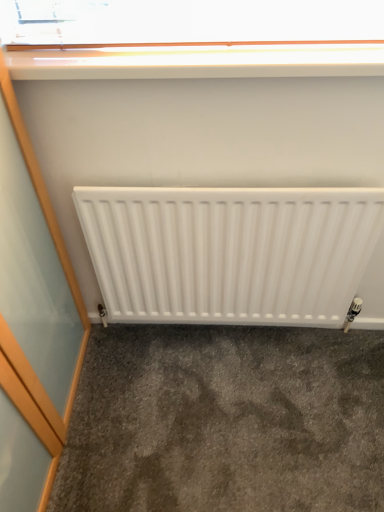
Measure the distance between gray carpet at lower center and camera.

The distance of gray carpet at lower center from camera is 1.34 meters.

This screenshot has height=512, width=384. What do you see at coordinates (197, 62) in the screenshot?
I see `white glossy window sill at upper center` at bounding box center [197, 62].

Identify the location of white matte radiator at center. This screenshot has width=384, height=512. (230, 252).

Where is `radiator in front of the gray carpet at lower center`? radiator in front of the gray carpet at lower center is located at coordinates (230, 252).

Considering the sizes of objects white matte radiator at center and gray carpet at lower center in the image provided, who is wider, white matte radiator at center or gray carpet at lower center?

Wider between the two is gray carpet at lower center.

What's the angular difference between white matte radiator at center and gray carpet at lower center's facing directions?

0.477 degrees.

Is gray carpet at lower center a part of white matte radiator at center?

Definitely not — gray carpet at lower center is not inside white matte radiator at center.

Can you confirm if gray carpet at lower center is bigger than white matte radiator at center?

Incorrect, gray carpet at lower center is not larger than white matte radiator at center.

Which is more to the right, gray carpet at lower center or white matte radiator at center?

Positioned to the right is gray carpet at lower center.

From a real-world perspective, which is physically below, gray carpet at lower center or white matte radiator at center?

In real-world perspective, gray carpet at lower center is lower.

Considering the sizes of objects white glossy window sill at upper center and gray carpet at lower center in the image provided, who is smaller, white glossy window sill at upper center or gray carpet at lower center?

With smaller size is white glossy window sill at upper center.

Does point (110, 56) come closer to viewer compared to point (349, 416)?

Yes, it is in front of point (349, 416).

Image resolution: width=384 pixels, height=512 pixels. Identify the location of window sill in front of the gray carpet at lower center. (197, 62).

How many degrees apart are the facing directions of white glossy window sill at upper center and gray carpet at lower center?

white glossy window sill at upper center and gray carpet at lower center are facing 0.343 degrees away from each other.

In the scene shown: Does white matte radiator at center have a larger size compared to white glossy window sill at upper center?

Indeed, white matte radiator at center has a larger size compared to white glossy window sill at upper center.

Could you tell me if white matte radiator at center is facing white glossy window sill at upper center?

No.

Which object is wider, white glossy window sill at upper center or white matte radiator at center?

white glossy window sill at upper center is wider.

Is the position of white glossy window sill at upper center less distant than that of white matte radiator at center?

Yes, the depth of white glossy window sill at upper center is less than that of white matte radiator at center.

The width and height of the screenshot is (384, 512). In order to click on window sill that is in front of the white matte radiator at center in this screenshot , I will do `click(197, 62)`.

How many degrees apart are the facing directions of white glossy window sill at upper center and white matte radiator at center?

The facing directions of white glossy window sill at upper center and white matte radiator at center are 0.134 degrees apart.

Considering the positions of points (196, 422) and (59, 67), is point (196, 422) farther from camera compared to point (59, 67)?

That is True.

Which is more to the right, gray carpet at lower center or white glossy window sill at upper center?

From the viewer's perspective, gray carpet at lower center appears more on the right side.

From the image's perspective, which object appears higher, gray carpet at lower center or white glossy window sill at upper center?

white glossy window sill at upper center is shown above in the image.

Considering the relative sizes of gray carpet at lower center and white glossy window sill at upper center in the image provided, is gray carpet at lower center smaller than white glossy window sill at upper center?

Actually, gray carpet at lower center might be larger than white glossy window sill at upper center.

Image resolution: width=384 pixels, height=512 pixels. I want to click on concrete below the white matte radiator at center (from a real-world perspective), so click(226, 421).

Where is `concrete that appears behind the white matte radiator at center`? concrete that appears behind the white matte radiator at center is located at coordinates click(x=226, y=421).

Which object lies nearer to the anchor point gray carpet at lower center, white matte radiator at center or white glossy window sill at upper center?

Based on the image, white matte radiator at center appears to be nearer to gray carpet at lower center.

From the picture: Which object lies further to the anchor point white matte radiator at center, gray carpet at lower center or white glossy window sill at upper center?

white glossy window sill at upper center lies further to white matte radiator at center than the other object.

Considering their positions, is white glossy window sill at upper center positioned closer to white matte radiator at center than gray carpet at lower center?

gray carpet at lower center lies closer to white matte radiator at center than the other object.

Estimate the real-world distances between objects in this image. Which object is closer to gray carpet at lower center, white glossy window sill at upper center or white matte radiator at center?

The object closer to gray carpet at lower center is white matte radiator at center.

Looking at the image, which one is located further to white glossy window sill at upper center, gray carpet at lower center or white matte radiator at center?

gray carpet at lower center lies further to white glossy window sill at upper center than the other object.

When comparing their distances from white glossy window sill at upper center, does white matte radiator at center or gray carpet at lower center seem further?

Based on the image, gray carpet at lower center appears to be further to white glossy window sill at upper center.

At what (x,y) coordinates should I click in order to perform the action: click on radiator between white glossy window sill at upper center and gray carpet at lower center vertically. Please return your answer as a coordinate pair (x, y). Looking at the image, I should click on (230, 252).